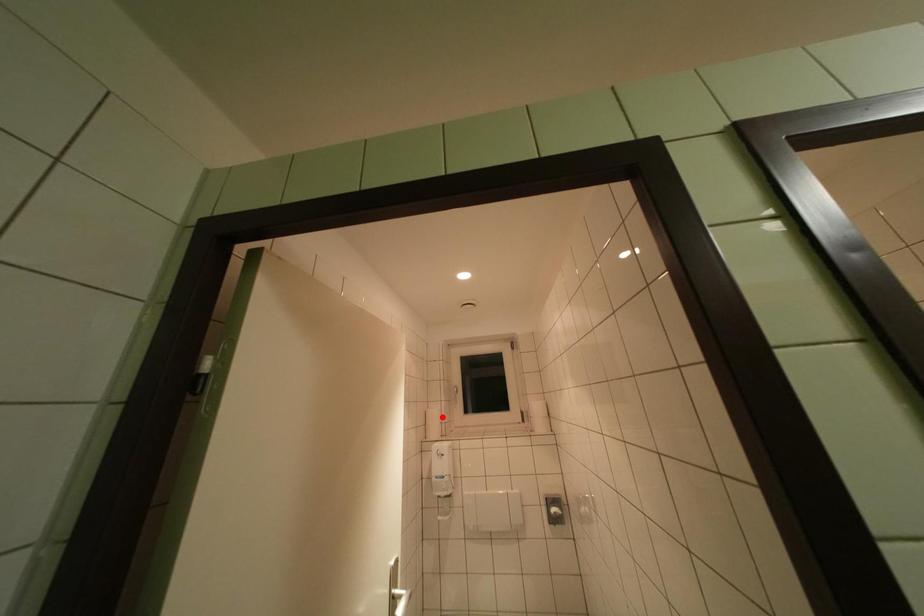
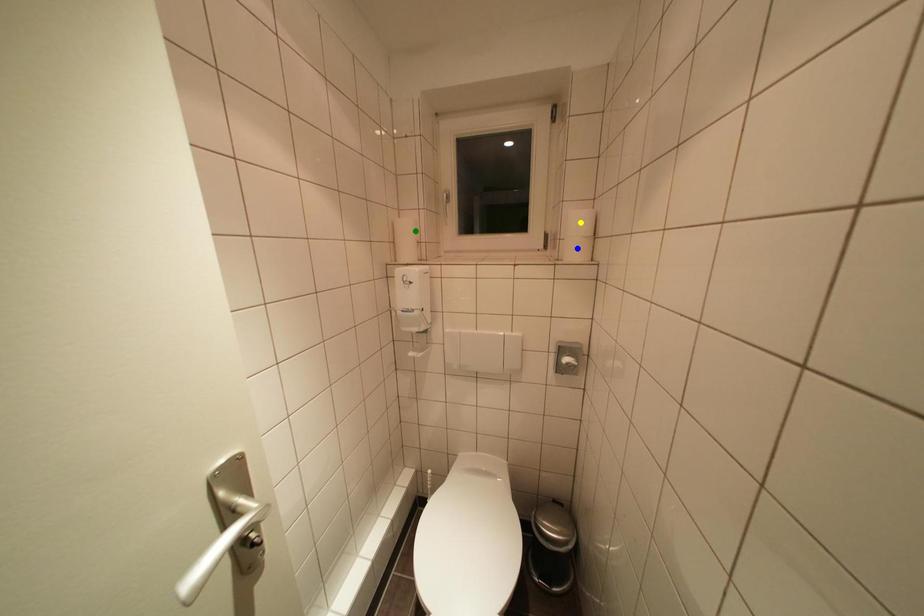
Question: I am providing you with two images of the same scene from different viewpoints. A red point is marked on the first image. You are given multiple points on the second image. Can you choose the point in image 2 that corresponds to the point in image 1?

Choices:
 (A) green point
 (B) blue point
 (C) yellow point

Answer: (A)